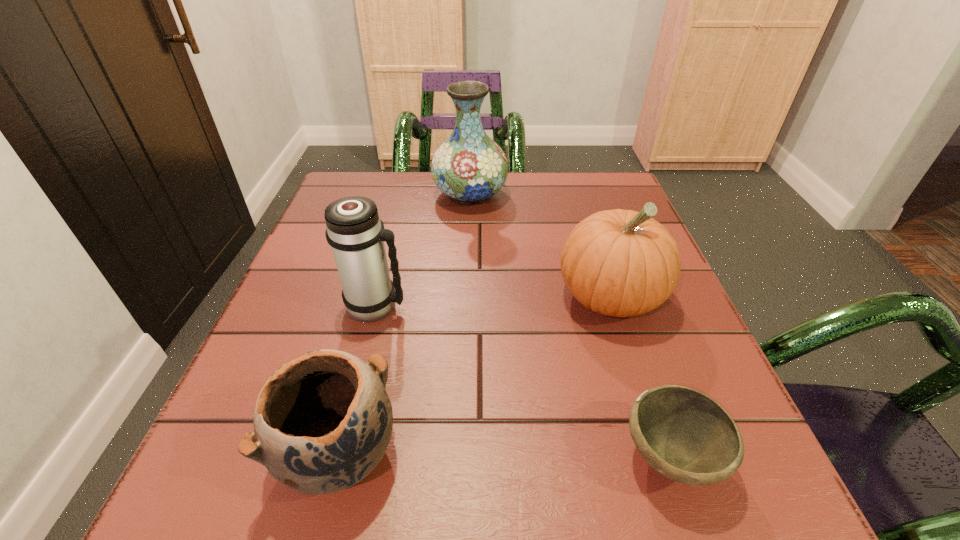
I want to click on vacant space situated 0.170m on the back of the bowl, so click(627, 329).

This screenshot has height=540, width=960. What are the coordinates of `object situated at the far edge` in the screenshot? It's located at (469, 167).

This screenshot has height=540, width=960. I want to click on pottery that is at the near edge, so click(322, 422).

The width and height of the screenshot is (960, 540). Identify the location of bowl that is at the near edge. (686, 436).

Where is `thermos bottle located in the left edge section of the desktop`? The image size is (960, 540). thermos bottle located in the left edge section of the desktop is located at coordinates (354, 230).

In order to click on pottery that is positioned at the left edge in this screenshot , I will do `click(322, 422)`.

The height and width of the screenshot is (540, 960). I want to click on pumpkin located at the right edge, so click(x=621, y=263).

Where is `bowl present at the right edge`? The width and height of the screenshot is (960, 540). bowl present at the right edge is located at coordinates (686, 436).

Identify the location of object that is positioned at the near left corner. This screenshot has height=540, width=960. (322, 422).

The image size is (960, 540). I want to click on object located in the near right corner section of the desktop, so click(x=686, y=436).